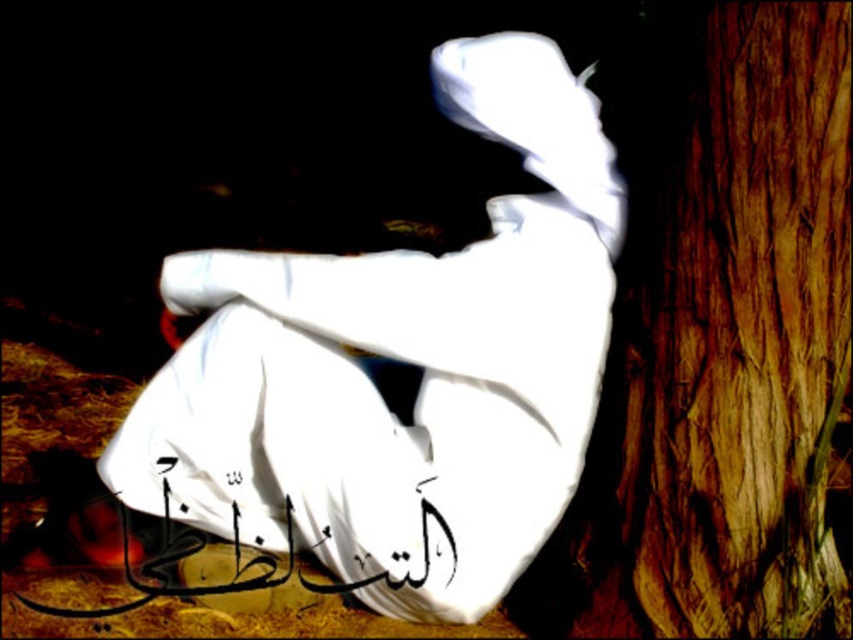
Between white cloth at center and black calligraphy at lower center, which one appears on the right side from the viewer's perspective?

From the viewer's perspective, white cloth at center appears more on the right side.

From the picture: Does white cloth at center have a lesser height compared to black calligraphy at lower center?

No, white cloth at center is not shorter than black calligraphy at lower center.

What do you see at coordinates (403, 362) in the screenshot? I see `white cloth at center` at bounding box center [403, 362].

Where is `white cloth at center`? This screenshot has width=853, height=640. white cloth at center is located at coordinates (403, 362).

Does smooth brown bark at right appear under black calligraphy at lower center?

Incorrect, smooth brown bark at right is not positioned below black calligraphy at lower center.

In the scene shown: Is smooth brown bark at right above black calligraphy at lower center?

Indeed, smooth brown bark at right is positioned over black calligraphy at lower center.

What do you see at coordinates (718, 342) in the screenshot? The width and height of the screenshot is (853, 640). I see `smooth brown bark at right` at bounding box center [718, 342].

At what (x,y) coordinates should I click in order to perform the action: click on smooth brown bark at right. Please return your answer as a coordinate pair (x, y). This screenshot has height=640, width=853. Looking at the image, I should click on (718, 342).

Does white cloth at center appear under smooth brown bark at right?

Incorrect, white cloth at center is not positioned below smooth brown bark at right.

Does point (519, 257) come behind point (840, 326)?

Yes, it is.

This screenshot has height=640, width=853. What do you see at coordinates (403, 362) in the screenshot?
I see `white cloth at center` at bounding box center [403, 362].

Locate an element on the screen. white cloth at center is located at coordinates (403, 362).